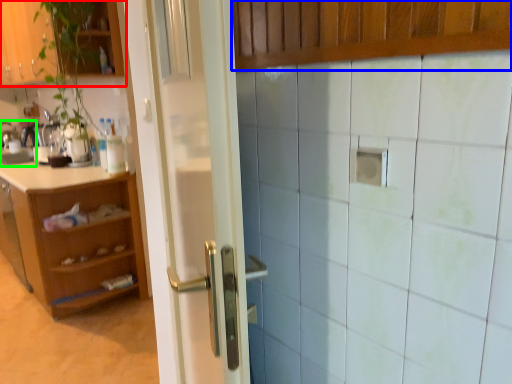
Question: Considering the real-world distances, which object is closest to cabinetry (highlighted by a red box)? cabinetry (highlighted by a blue box) or sink (highlighted by a green box).

Choices:
 (A) cabinetry
 (B) sink

Answer: (B)